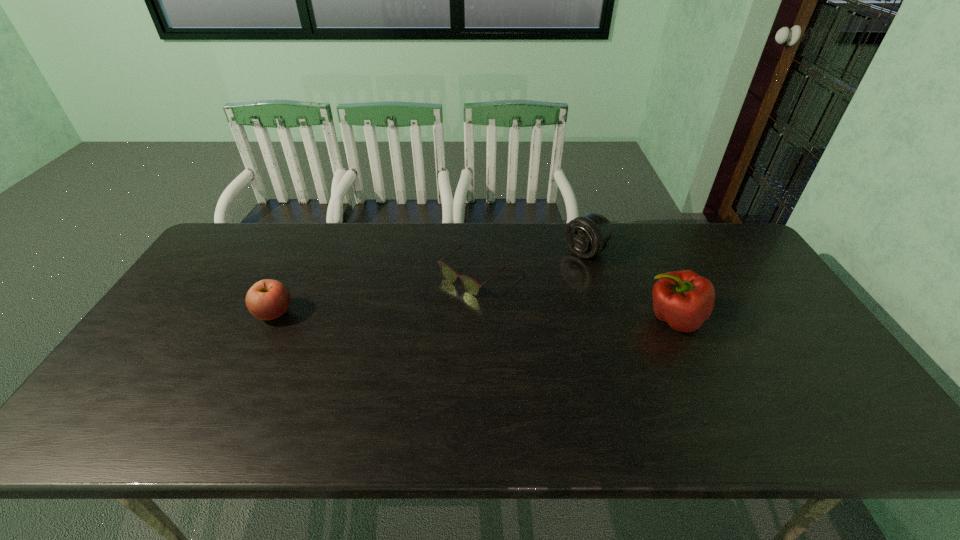
Identify the location of free space on the desktop that is between the apple and the rightmost object and is positioned on the front-facing side of the telephoto lens. (486, 316).

Where is `vacant space on the desktop that is between the leftmost object and the rightmost object and is positioned at the front view of the shortest object`? vacant space on the desktop that is between the leftmost object and the rightmost object and is positioned at the front view of the shortest object is located at coordinates (423, 315).